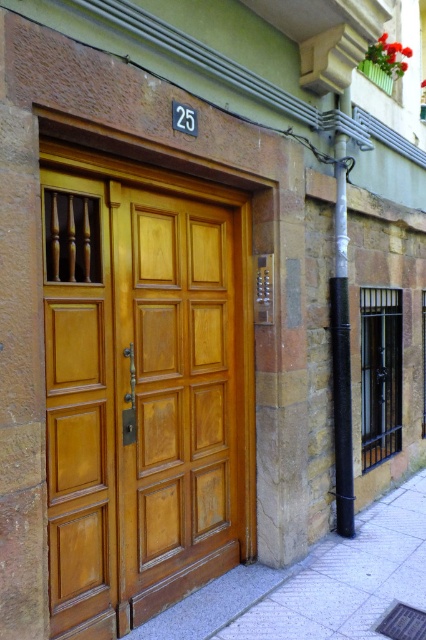
Does point (75, 196) come in front of point (403, 518)?

Yes.

The image size is (426, 640). What are the coordinates of `wooden door at center` in the screenshot? It's located at (143, 388).

Between gray concrete pavement at lower right and white painted metal pole at right, which one appears on the left side from the viewer's perspective?

white painted metal pole at right

Between point (397, 497) and point (340, 269), which one is positioned in front?

Positioned in front is point (340, 269).

You are a GUI agent. You are given a task and a screenshot of the screen. Output one action in this format:
    pyautogui.click(x=<x>, y=<y>)
    Task: Click on the gray concrete pavement at lower right
    The height and width of the screenshot is (640, 426).
    Given the screenshot: What is the action you would take?
    pyautogui.click(x=348, y=577)

Consider the image. Who is taller, wooden door at center or white painted metal pole at right?

white painted metal pole at right is taller.

Which is in front, point (218, 424) or point (331, 282)?

Point (218, 424) is more forward.

Image resolution: width=426 pixels, height=640 pixels. What are the coordinates of `wooden door at center` in the screenshot? It's located at (143, 388).

This screenshot has width=426, height=640. In order to click on wooden door at center in this screenshot , I will do `click(143, 388)`.